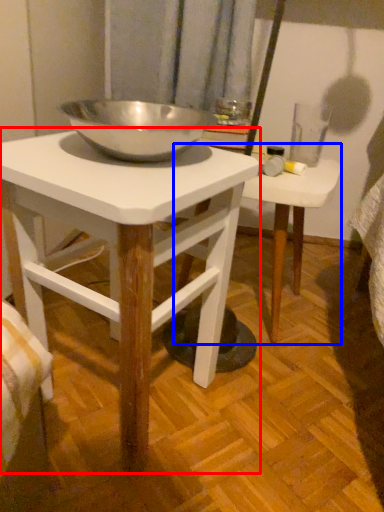
Question: Which object appears closest to the camera in this image, table (highlighted by a red box) or table (highlighted by a blue box)?

Choices:
 (A) table
 (B) table

Answer: (A)